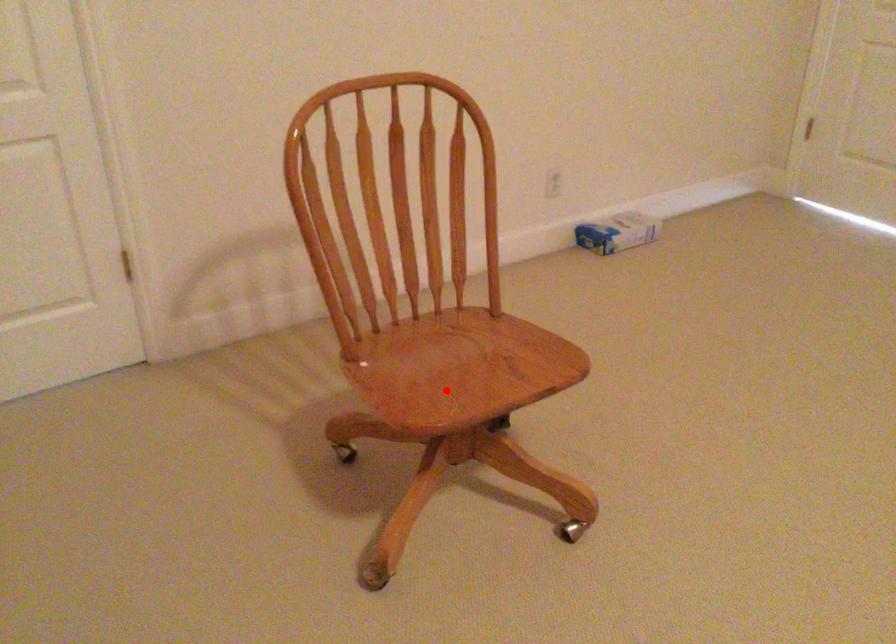
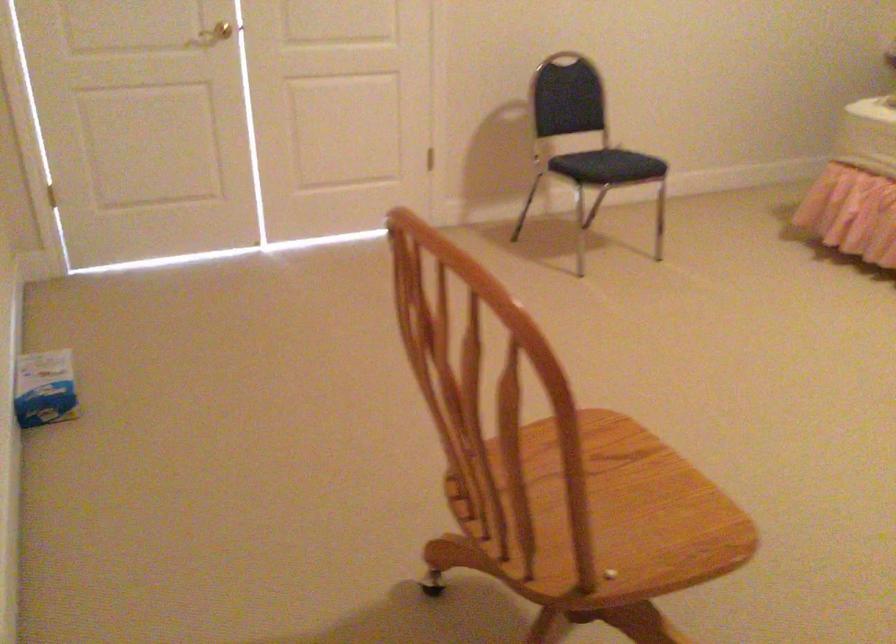
Where in the second image is the point corresponding to the highlighted location from the first image?

(613, 509)